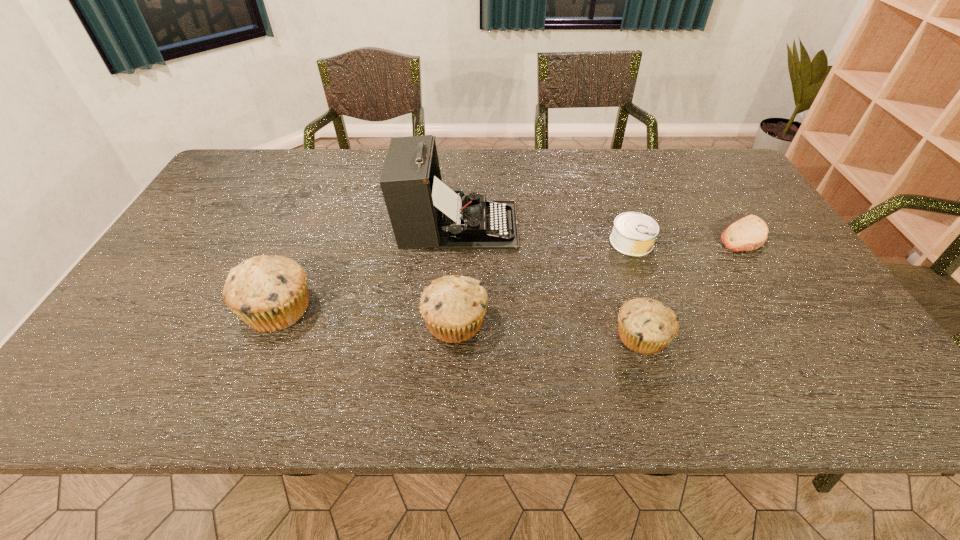
Find the location of a particular element. The width and height of the screenshot is (960, 540). free space at the near left corner of the desktop is located at coordinates (143, 361).

The height and width of the screenshot is (540, 960). What are the coordinates of `free space at the far right corner of the desktop` in the screenshot? It's located at (702, 188).

Where is `vacant region at the near right corner of the desktop`? vacant region at the near right corner of the desktop is located at coordinates (800, 343).

The height and width of the screenshot is (540, 960). Find the location of `empty space between the pita bread and the typewriter`. empty space between the pita bread and the typewriter is located at coordinates (600, 230).

You are a GUI agent. You are given a task and a screenshot of the screen. Output one action in this format:
    pyautogui.click(x=<x>, y=<y>)
    Task: Click on the vacant space in between the shortest object and the second muffin from left to right
    This screenshot has height=540, width=960.
    Given the screenshot: What is the action you would take?
    pyautogui.click(x=599, y=279)

At what (x,y) coordinates should I click in order to perform the action: click on free space between the shortest object and the can. Please return your answer as a coordinate pair (x, y). This screenshot has height=540, width=960. Looking at the image, I should click on (687, 239).

You are a GUI agent. You are given a task and a screenshot of the screen. Output one action in this format:
    pyautogui.click(x=<x>, y=<y>)
    Task: Click on the free point between the fourth tallest object and the rightmost object
    
    Given the screenshot: What is the action you would take?
    pyautogui.click(x=692, y=286)

Find the location of `vacant space that's between the fourth tallest object and the second muffin from left to right`. vacant space that's between the fourth tallest object and the second muffin from left to right is located at coordinates (548, 329).

You are a GUI agent. You are given a task and a screenshot of the screen. Output one action in this format:
    pyautogui.click(x=<x>, y=<y>)
    Task: Click on the vacant area that lies between the tallest object and the rightmost muffin
    
    Given the screenshot: What is the action you would take?
    pyautogui.click(x=549, y=281)

I want to click on vacant area between the rightmost muffin and the second shortest object, so click(x=636, y=289).